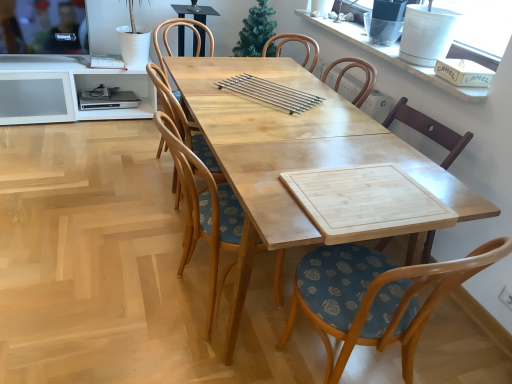
The width and height of the screenshot is (512, 384). I want to click on vacant space in front of wooden chair with floral cushion at center, the 2th chair positioned from the back, so click(x=194, y=361).